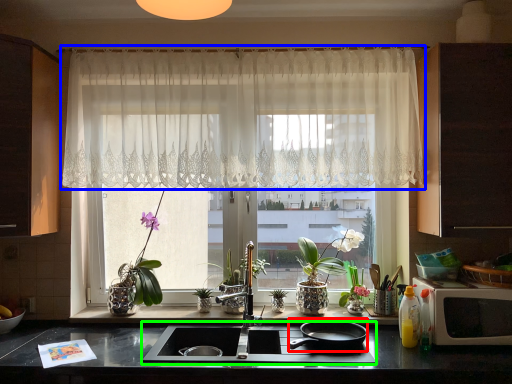
Question: Estimate the real-world distances between objects in this image. Which object is farther from frying pan (highlighted by a red box), curtain (highlighted by a blue box) or gas stove (highlighted by a green box)?

Choices:
 (A) curtain
 (B) gas stove

Answer: (A)